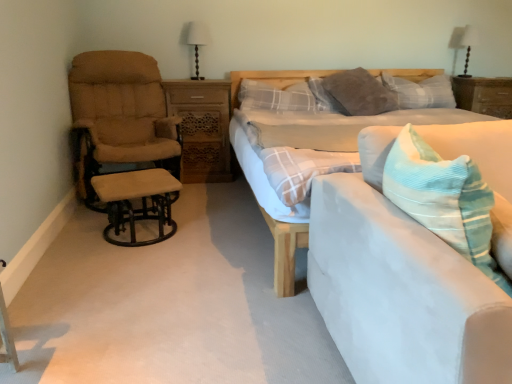
This screenshot has width=512, height=384. Find the location of `free spot to the right of beige fabric stool at left`. free spot to the right of beige fabric stool at left is located at coordinates (201, 236).